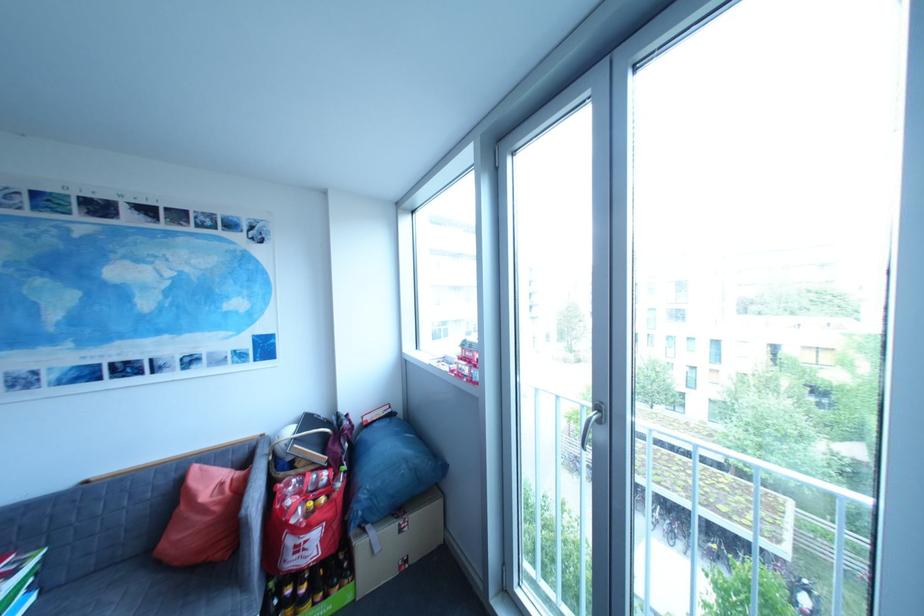
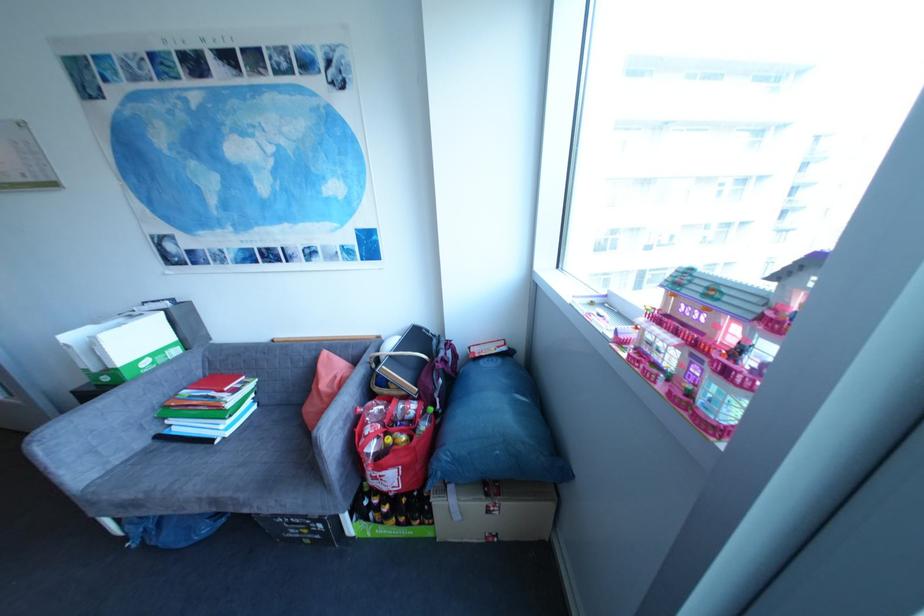
Based on the continuous images, in which direction is the camera rotating?

The camera rotated toward left-down.